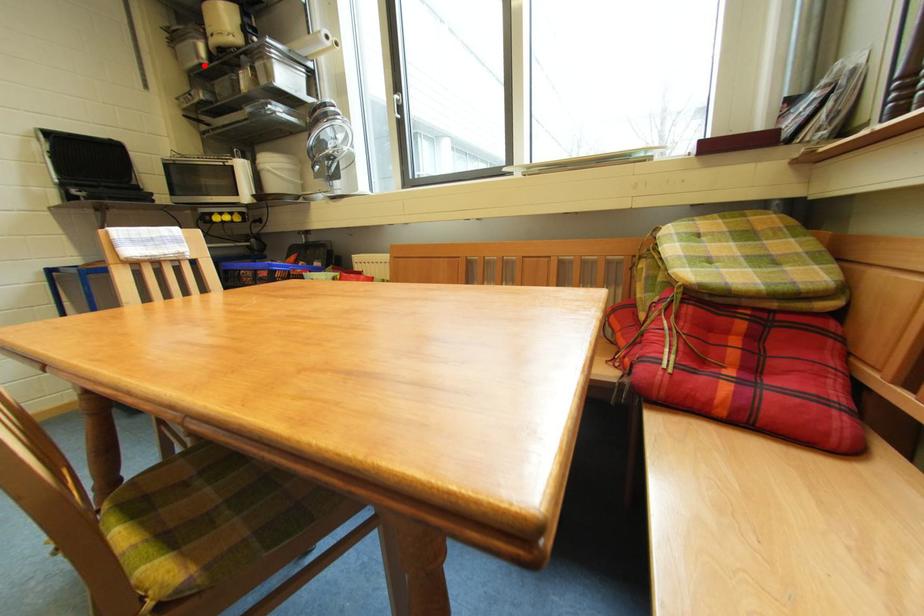
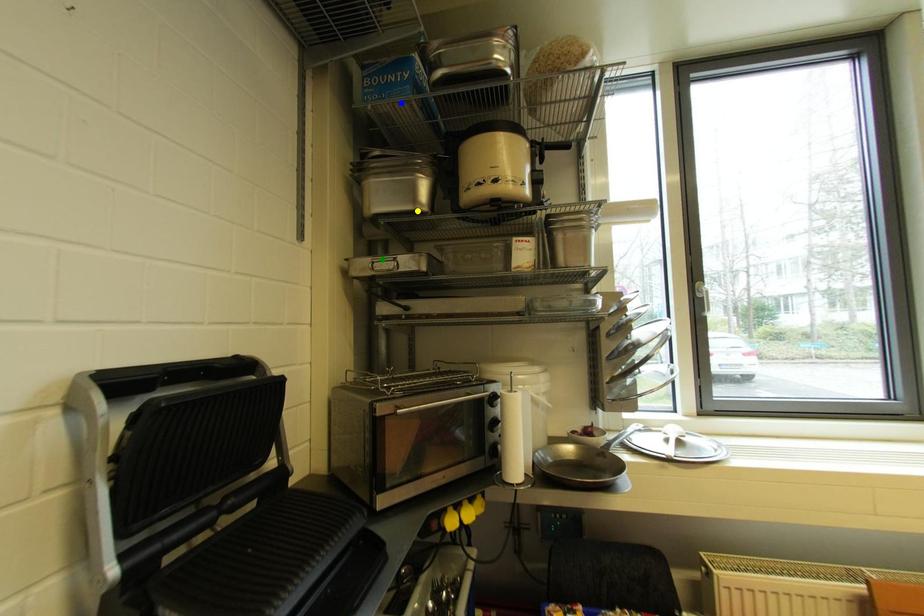
Question: I am providing you with two images of the same scene from different viewpoints. A red point is marked on the first image. You are given multiple points on the second image. Which point in image 2 is actually the same real-world point as the red point in image 1?

Choices:
 (A) green point
 (B) yellow point
 (C) blue point

Answer: (B)